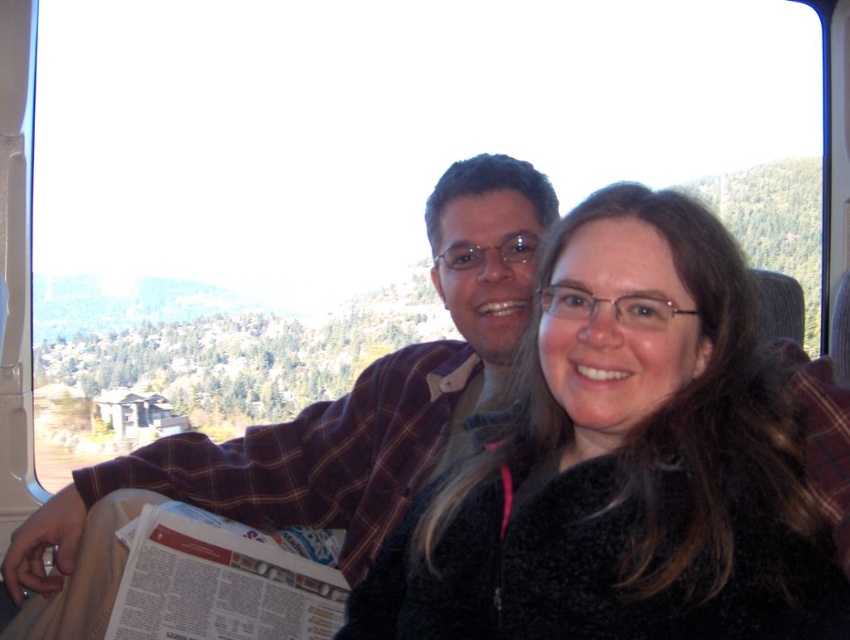
Does black fuzzy jacket at center appear on the right side of plaid fabric shirt at center?

Correct, you'll find black fuzzy jacket at center to the right of plaid fabric shirt at center.

Find the location of a particular element. black fuzzy jacket at center is located at coordinates (622, 465).